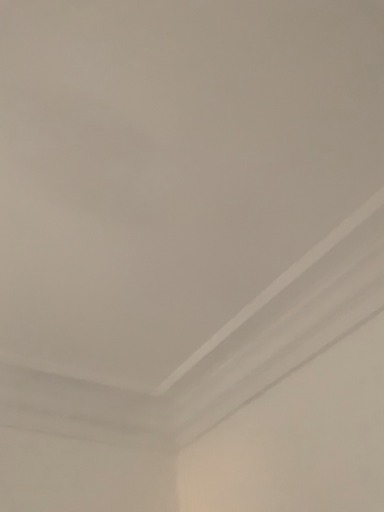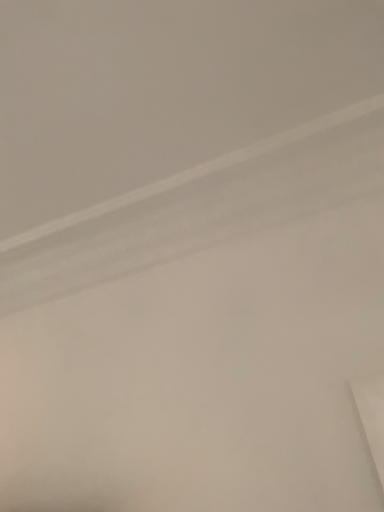
Question: Which way did the camera rotate in the video?

Choices:
 (A) rotated right
 (B) rotated left

Answer: (A)